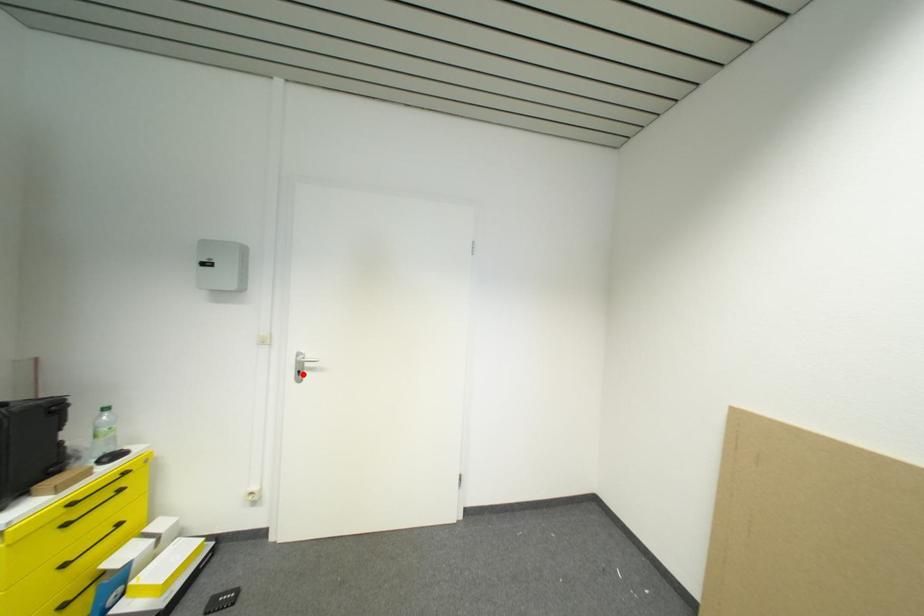
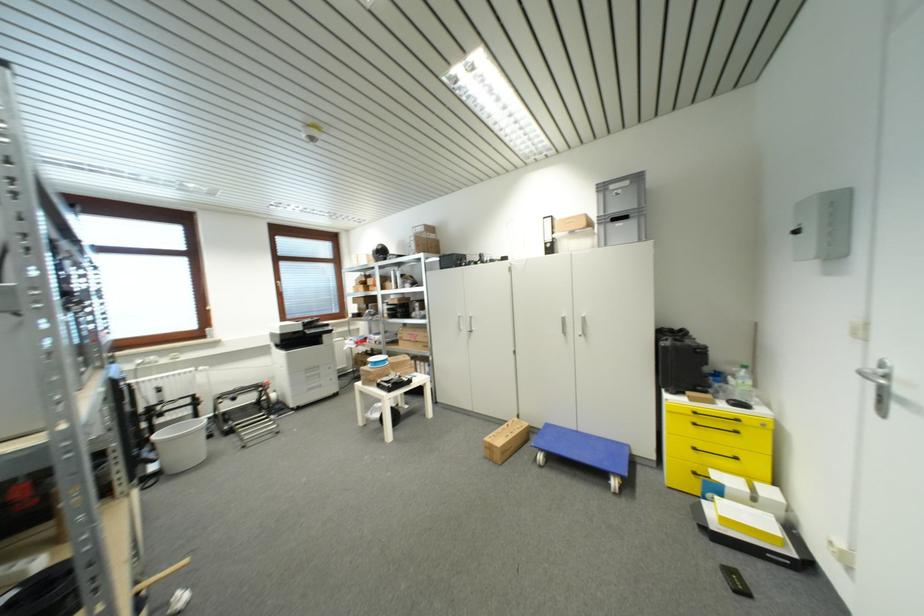
The point at the highlighted location is marked in the first image. Where is the corresponding point in the second image?

(884, 400)